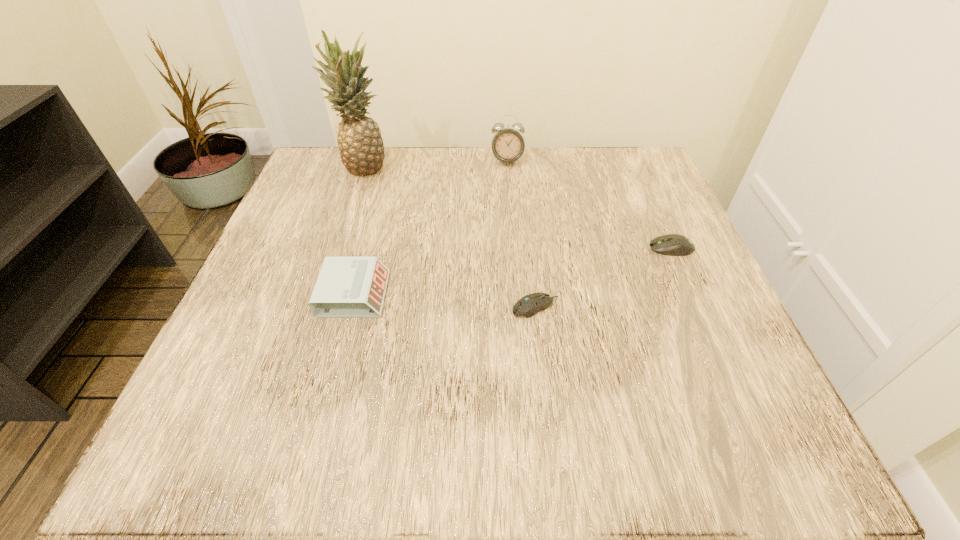
At what (x,y) coordinates should I click in order to perform the action: click on vacant point located between the farther computer mouse and the shorter alarm clock. Please return your answer as a coordinate pair (x, y). The width and height of the screenshot is (960, 540). Looking at the image, I should click on (513, 271).

You are a GUI agent. You are given a task and a screenshot of the screen. Output one action in this format:
    pyautogui.click(x=<x>, y=<y>)
    Task: Click on the vacant area that lies between the rightmost object and the left computer mouse
    Image resolution: width=960 pixels, height=540 pixels.
    Given the screenshot: What is the action you would take?
    pyautogui.click(x=604, y=278)

Where is `empty location between the third tallest object and the left computer mouse`? The image size is (960, 540). empty location between the third tallest object and the left computer mouse is located at coordinates (444, 301).

At what (x,y) coordinates should I click in order to perform the action: click on vacant region between the right computer mouse and the right alarm clock. Please return your answer as a coordinate pair (x, y). The height and width of the screenshot is (540, 960). Looking at the image, I should click on (589, 205).

I want to click on vacant space that is in between the pineapple and the shortest object, so tap(449, 238).

Image resolution: width=960 pixels, height=540 pixels. I want to click on free spot between the left computer mouse and the tallest object, so click(x=449, y=238).

The width and height of the screenshot is (960, 540). I want to click on vacant area between the right alarm clock and the nearer computer mouse, so click(521, 234).

You are a GUI agent. You are given a task and a screenshot of the screen. Output one action in this format:
    pyautogui.click(x=<x>, y=<y>)
    Task: Click on the unoccupied area between the fourth shortest object and the left computer mouse
    The image size is (960, 540).
    Given the screenshot: What is the action you would take?
    [x=521, y=234]

Locate an element on the screen. vacant point located between the third tallest object and the farther alarm clock is located at coordinates (430, 227).

Identify which object is the second closest to the taller alarm clock. Please provide its 2D coordinates. Your answer should be formatted as a tuple, i.e. [(x, y)], where the tuple contains the x and y coordinates of a point satisfying the conditions above.

[(672, 244)]